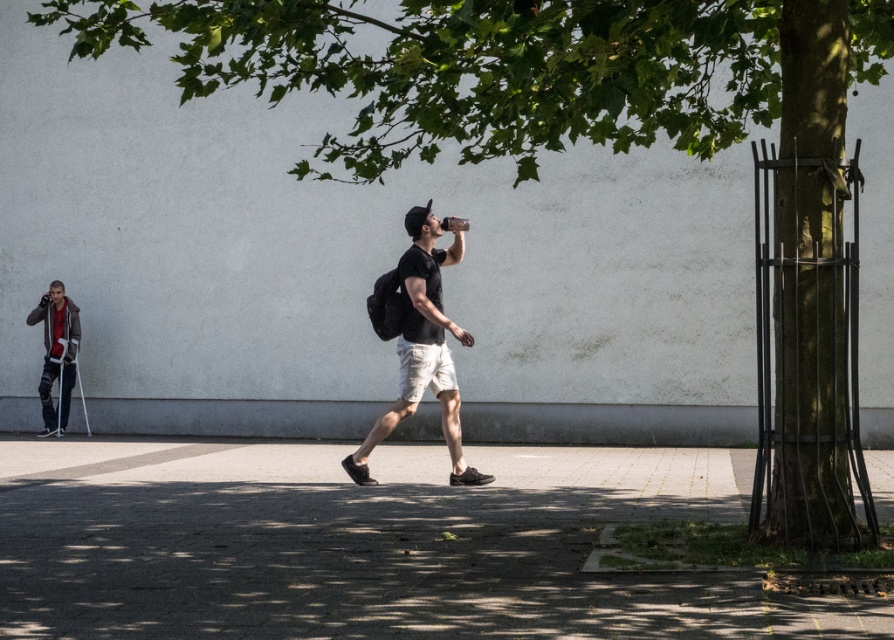
Question: Does gray concrete pavement at center appear over matte black backpack at center?

Choices:
 (A) no
 (B) yes

Answer: (A)

Question: Can you confirm if gray concrete pavement at center is smaller than matte black backpack at center?

Choices:
 (A) yes
 (B) no

Answer: (B)

Question: Does gray concrete pavement at center lie in front of matte black backpack at center?

Choices:
 (A) yes
 (B) no

Answer: (A)

Question: Which point is closer to the camera taking this photo?

Choices:
 (A) (441, 412)
 (B) (374, 592)

Answer: (B)

Question: Which point appears farthest from the camera in this image?

Choices:
 (A) (705, 611)
 (B) (448, 362)

Answer: (B)